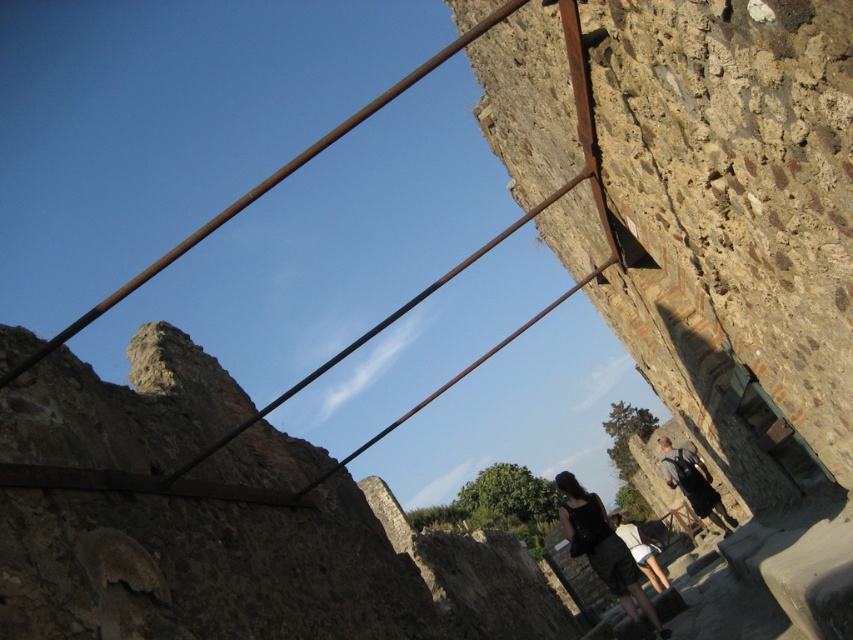
Which is more to the left, dark gray fabric dress at center or white cotton shirt at lower center?

dark gray fabric dress at center is more to the left.

Image resolution: width=853 pixels, height=640 pixels. I want to click on dark gray fabric dress at center, so click(602, 548).

Identify the location of dark gray fabric dress at center. This screenshot has width=853, height=640. 602,548.

Which is in front, point (277, 172) or point (576, 528)?

Point (277, 172)

Is point (84, 324) positioned behind point (619, 538)?

No, (84, 324) is closer to viewer.

Is point (189, 236) closer to camera compared to point (633, 572)?

No.

This screenshot has height=640, width=853. Identify the location of rusty metal rail at upper center. (471, 259).

Which is more to the left, rusty metal rail at upper center or dark gray backpack at center?

Answer: rusty metal rail at upper center

Which is behind, point (392, 316) or point (688, 452)?

Point (688, 452)

What do you see at coordinates (471, 259) in the screenshot? I see `rusty metal rail at upper center` at bounding box center [471, 259].

I want to click on rusty metal rail at upper center, so click(x=471, y=259).